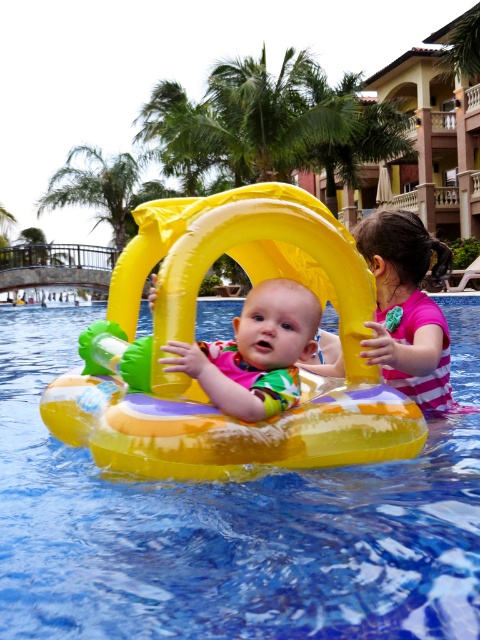
Question: Among these objects, which one is farthest from the camera?

Choices:
 (A) matte yellow float at center
 (B) green leafy palm tree at upper left
 (C) transparent plastic float at center

Answer: (B)

Question: Is transparent plastic float at center to the left of pink striped swimsuit at right from the viewer's perspective?

Choices:
 (A) no
 (B) yes

Answer: (B)

Question: Which object appears farthest from the camera in this image?

Choices:
 (A) transparent plastic float at center
 (B) green leafy palm tree at upper left
 (C) pink striped swimsuit at right

Answer: (B)

Question: Which of the following is the closest to the observer?

Choices:
 (A) (21, 336)
 (B) (96, 221)
 (C) (431, 244)
 (D) (268, 392)

Answer: (D)

Question: Is matte yellow float at center smaller than green leafy palm tree at upper left?

Choices:
 (A) no
 (B) yes

Answer: (B)

Question: Is transparent plastic float at center smaller than pink striped swimsuit at right?

Choices:
 (A) yes
 (B) no

Answer: (B)